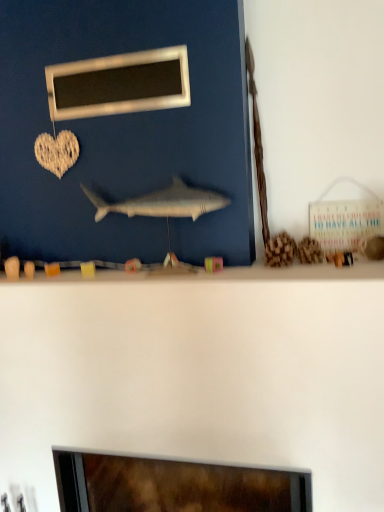
Question: Would you say metallic rectangular frame at upper center contains gray matte shark at center?

Choices:
 (A) yes
 (B) no

Answer: (B)

Question: Considering the relative sizes of metallic rectangular frame at upper center and gray matte shark at center in the image provided, is metallic rectangular frame at upper center shorter than gray matte shark at center?

Choices:
 (A) no
 (B) yes

Answer: (A)

Question: Can you confirm if metallic rectangular frame at upper center is positioned to the right of gray matte shark at center?

Choices:
 (A) yes
 (B) no

Answer: (B)

Question: Is metallic rectangular frame at upper center at the left side of gray matte shark at center?

Choices:
 (A) yes
 (B) no

Answer: (A)

Question: Is metallic rectangular frame at upper center next to gray matte shark at center and touching it?

Choices:
 (A) no
 (B) yes

Answer: (A)

Question: From the image's perspective, is metallic rectangular frame at upper center under gray matte shark at center?

Choices:
 (A) no
 (B) yes

Answer: (A)

Question: Is gray matte shark at center in contact with metallic rectangular frame at upper center?

Choices:
 (A) no
 (B) yes

Answer: (A)

Question: From a real-world perspective, is gray matte shark at center below metallic rectangular frame at upper center?

Choices:
 (A) no
 (B) yes

Answer: (B)

Question: Is gray matte shark at center smaller than metallic rectangular frame at upper center?

Choices:
 (A) no
 (B) yes

Answer: (A)

Question: Are gray matte shark at center and metallic rectangular frame at upper center located far from each other?

Choices:
 (A) no
 (B) yes

Answer: (A)

Question: Is gray matte shark at center not within metallic rectangular frame at upper center?

Choices:
 (A) no
 (B) yes

Answer: (B)

Question: Does gray matte shark at center have a greater width compared to metallic rectangular frame at upper center?

Choices:
 (A) yes
 (B) no

Answer: (A)

Question: From the image's perspective, is metallic rectangular frame at upper center positioned above or below gray matte shark at center?

Choices:
 (A) above
 (B) below

Answer: (A)